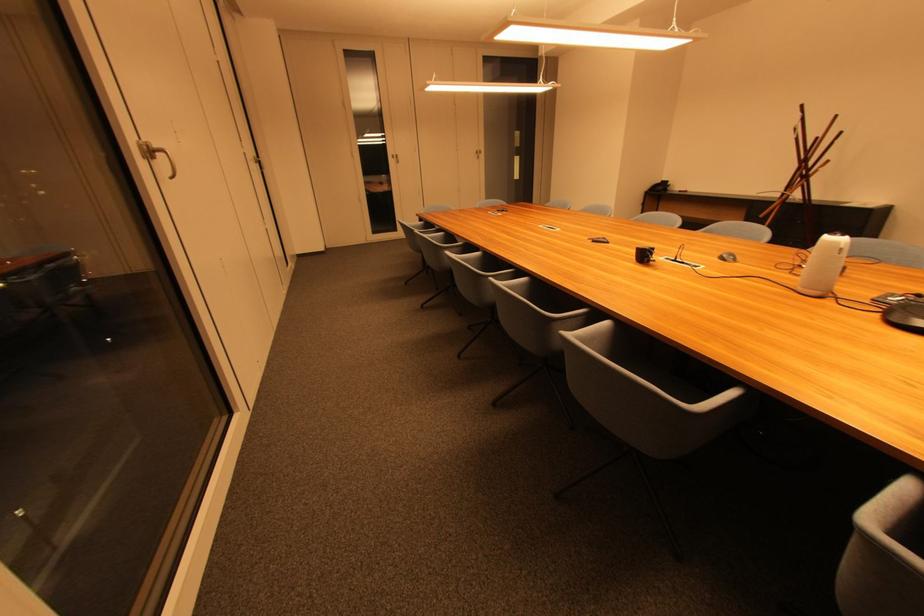
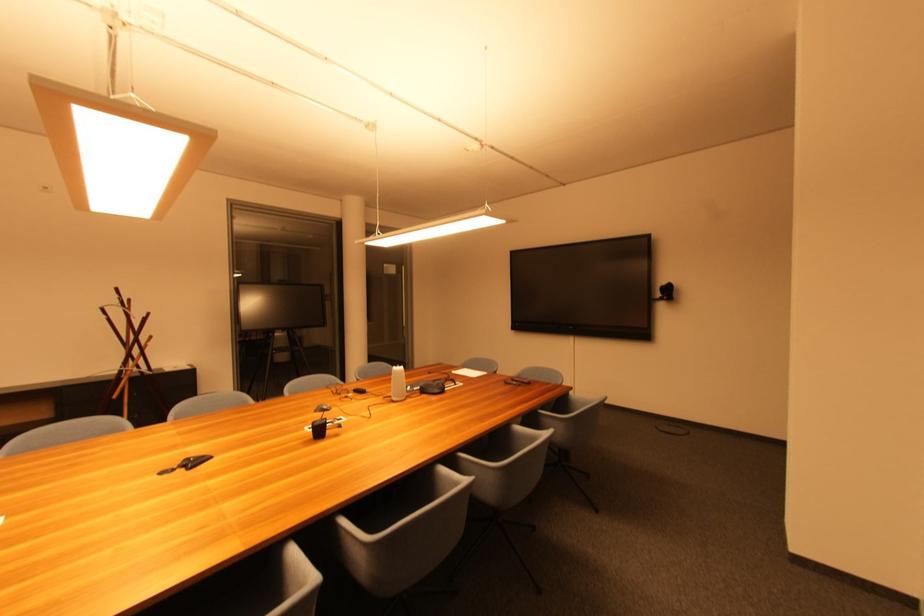
Where in the second image is the point corresponding to point 649,257 from the first image?

(324, 432)